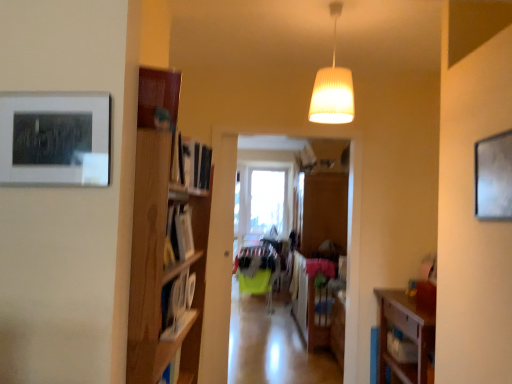
Question: Does wooden floor at center have a lesser width compared to matte black picture frame at upper left, which is the first picture frame from front to back?

Choices:
 (A) yes
 (B) no

Answer: (B)

Question: From a real-world perspective, is wooden floor at center below matte black picture frame at upper left, which is the first picture frame from front to back?

Choices:
 (A) yes
 (B) no

Answer: (A)

Question: From a real-world perspective, is wooden floor at center on matte black picture frame at upper left, which appears as the 1th picture frame when viewed from the left?

Choices:
 (A) no
 (B) yes

Answer: (A)

Question: From the image's perspective, is wooden floor at center under matte black picture frame at upper left, which appears as the 1th picture frame when viewed from the left?

Choices:
 (A) yes
 (B) no

Answer: (A)

Question: From the image's perspective, is wooden floor at center on top of matte black picture frame at upper left, which is the first picture frame from front to back?

Choices:
 (A) yes
 (B) no

Answer: (B)

Question: Considering the positions of point (73, 102) and point (237, 324), is point (73, 102) closer or farther from the camera than point (237, 324)?

Choices:
 (A) closer
 (B) farther

Answer: (A)

Question: Is matte black picture frame at upper left, positioned as the 2th picture frame in back-to-front order, wider or thinner than wooden floor at center?

Choices:
 (A) thin
 (B) wide

Answer: (A)

Question: From a real-world perspective, relative to wooden floor at center, is matte black picture frame at upper left, which is the first picture frame from front to back, vertically above or below?

Choices:
 (A) below
 (B) above

Answer: (B)

Question: In the image, is matte black picture frame at upper left, the 2th picture frame in the right-to-left sequence, positioned in front of or behind wooden floor at center?

Choices:
 (A) behind
 (B) front

Answer: (B)

Question: From the image's perspective, is matte black picture frame at upper left, positioned as the 2th picture frame in back-to-front order, positioned above or below white ribbed lampshade at upper center?

Choices:
 (A) below
 (B) above

Answer: (A)

Question: Based on their positions, is matte black picture frame at upper left, which is the first picture frame from front to back, located to the left or right of white ribbed lampshade at upper center?

Choices:
 (A) right
 (B) left

Answer: (B)

Question: In the image, is matte black picture frame at upper left, positioned as the 2th picture frame in back-to-front order, positioned in front of or behind white ribbed lampshade at upper center?

Choices:
 (A) front
 (B) behind

Answer: (A)

Question: Would you say matte black picture frame at upper left, positioned as the 2th picture frame in back-to-front order, is inside or outside white ribbed lampshade at upper center?

Choices:
 (A) outside
 (B) inside

Answer: (A)

Question: In terms of size, does wooden clothes rack at center appear bigger or smaller than matte black picture frame at upper left, the 2th picture frame in the right-to-left sequence?

Choices:
 (A) small
 (B) big

Answer: (B)

Question: In the image, is wooden clothes rack at center positioned in front of or behind matte black picture frame at upper left, positioned as the 2th picture frame in back-to-front order?

Choices:
 (A) front
 (B) behind

Answer: (B)